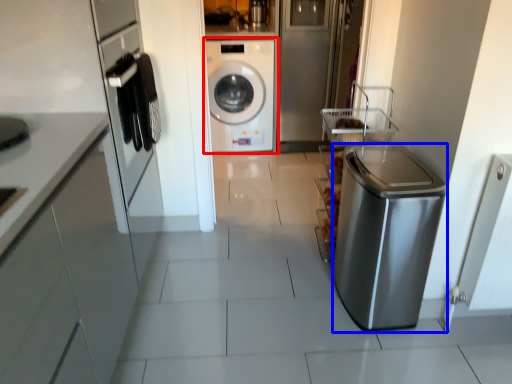
Question: Which of the following is the closest to the observer, washing machine (highlighted by a red box) or dish washer (highlighted by a blue box)?

Choices:
 (A) washing machine
 (B) dish washer

Answer: (B)